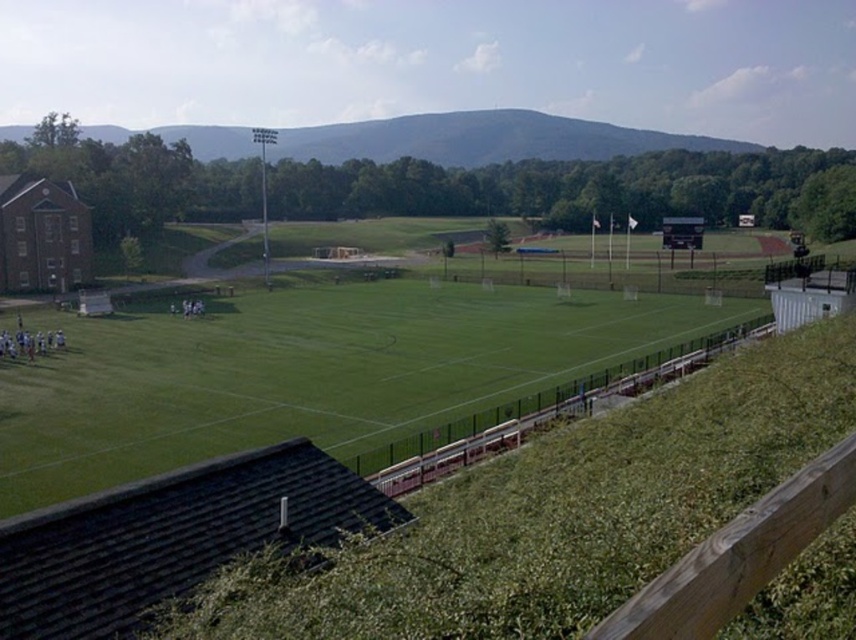
Question: Among these objects, which one is farthest from the camera?

Choices:
 (A) green grass field at center
 (B) brick building at left

Answer: (B)

Question: Can you confirm if green grass field at center is positioned to the left of brick building at left?

Choices:
 (A) no
 (B) yes

Answer: (A)

Question: Does green grass field at center appear on the left side of brick building at left?

Choices:
 (A) no
 (B) yes

Answer: (A)

Question: Among these objects, which one is farthest from the camera?

Choices:
 (A) green grass field at center
 (B) brick building at left

Answer: (B)

Question: Which point is closer to the camera?

Choices:
 (A) brick building at left
 (B) green grass field at center

Answer: (B)

Question: Is green grass field at center further to the viewer compared to brick building at left?

Choices:
 (A) yes
 (B) no

Answer: (B)